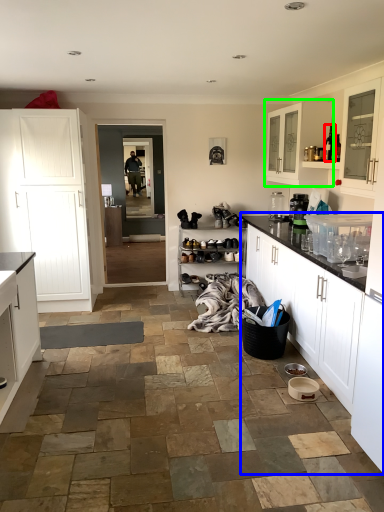
Question: Based on their relative distances, which object is nearer to bottle (highlighted by a red box)? Choose from cabinetry (highlighted by a blue box) and cabinetry (highlighted by a green box).

Choices:
 (A) cabinetry
 (B) cabinetry

Answer: (B)